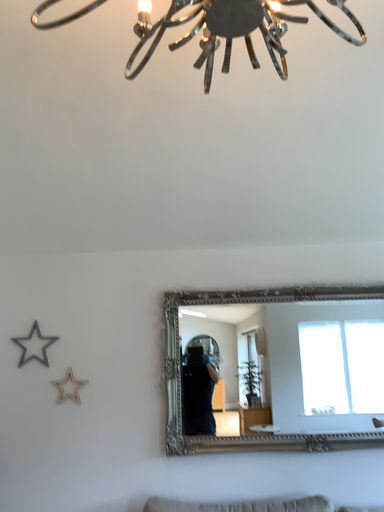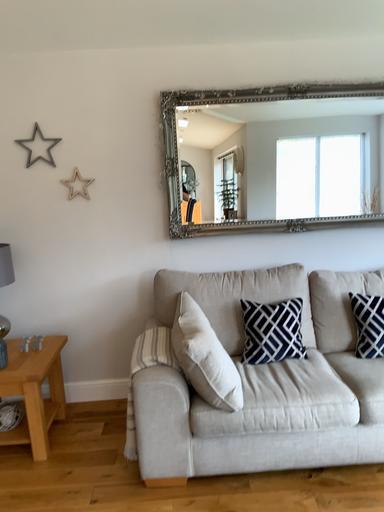
Question: How did the camera likely rotate when shooting the video?

Choices:
 (A) rotated downward
 (B) rotated upward

Answer: (A)